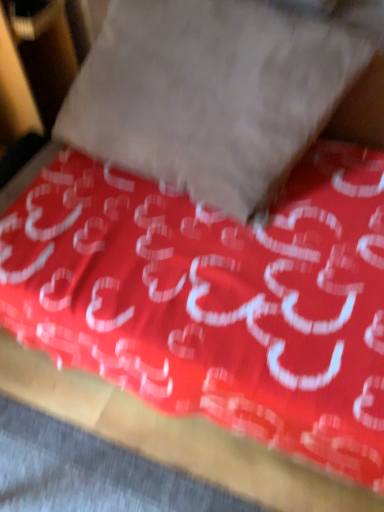
Find the location of a particular element. gray fabric pillow at upper center is located at coordinates pyautogui.click(x=209, y=94).

Describe the element at coordinates (209, 94) in the screenshot. This screenshot has height=512, width=384. I see `gray fabric pillow at upper center` at that location.

The width and height of the screenshot is (384, 512). In order to click on gray fabric pillow at upper center in this screenshot , I will do `click(209, 94)`.